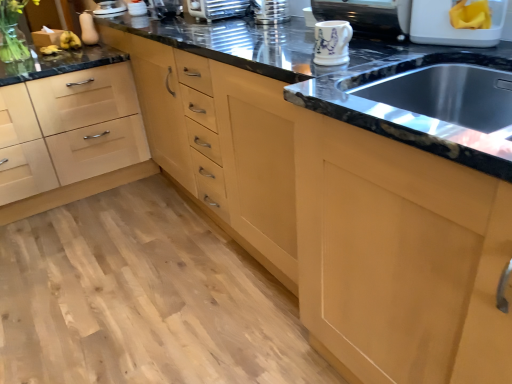
The image size is (512, 384). I want to click on free spot to the right of porcelain mug at upper center, the 3th appliance when ordered from right to left, so click(391, 51).